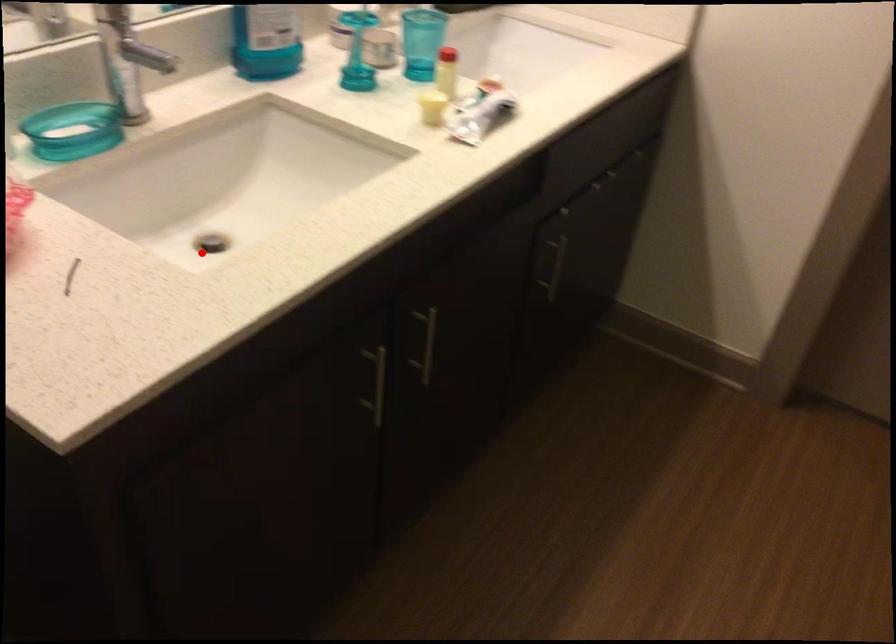
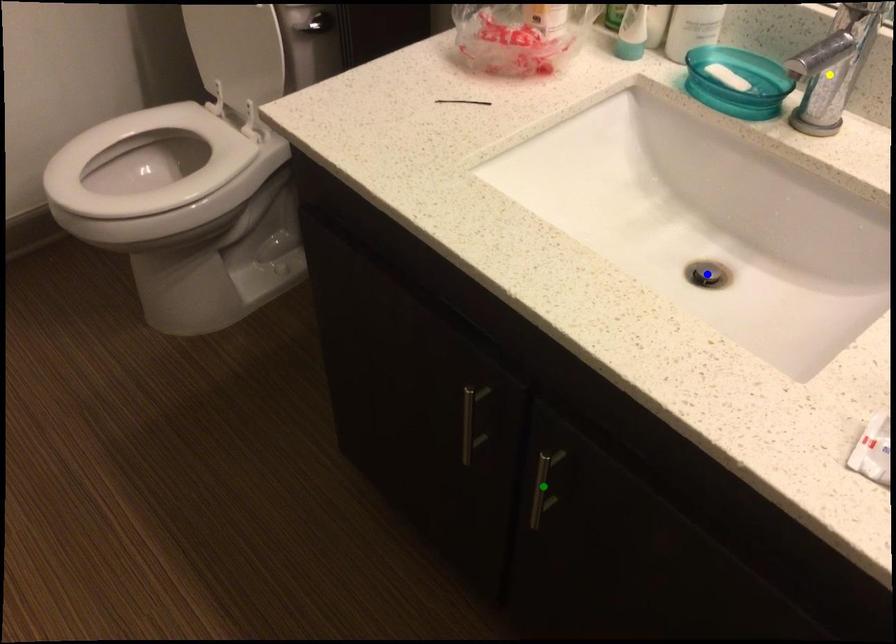
Question: I am providing you with two images of the same scene from different viewpoints. A red point is marked on the first image. You are given multiple points on the second image. Can you choose the point in image 2 that corresponds to the point in image 1?

Choices:
 (A) blue point
 (B) yellow point
 (C) green point

Answer: (A)